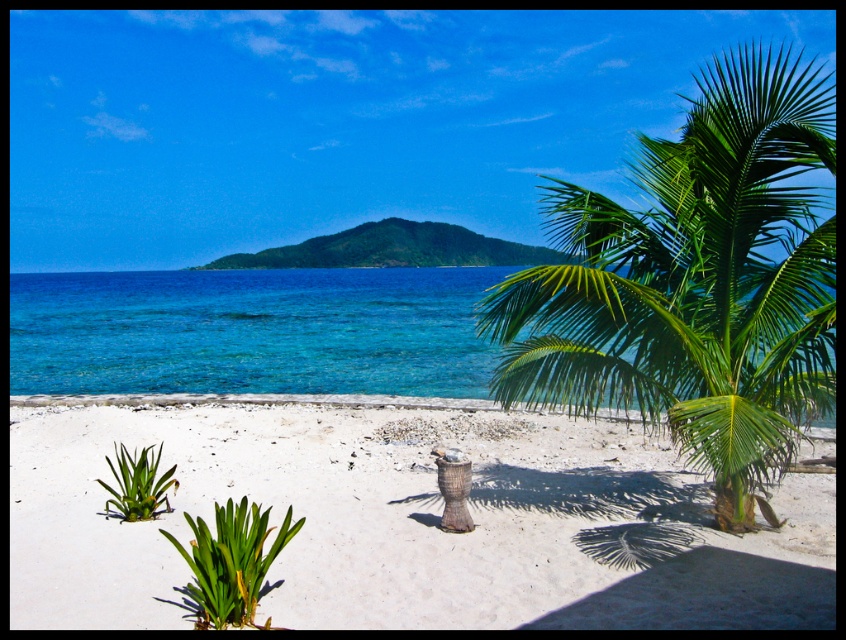
Question: Which object is positioned closest to the clear blue water at center?

Choices:
 (A) green leafy palm at center
 (B) white sandy beach at center

Answer: (A)

Question: Can you confirm if white sandy beach at center is thinner than clear blue water at center?

Choices:
 (A) yes
 (B) no

Answer: (A)

Question: Which point appears closest to the camera in this image?

Choices:
 (A) (709, 304)
 (B) (778, 547)

Answer: (B)

Question: Is green leafy palm at center bigger than clear blue water at center?

Choices:
 (A) no
 (B) yes

Answer: (B)

Question: Is white sandy beach at center to the right of green leafy palm at center from the viewer's perspective?

Choices:
 (A) no
 (B) yes

Answer: (A)

Question: Which is nearer to the clear blue water at center?

Choices:
 (A) white sandy beach at center
 (B) green leafy palm at center

Answer: (B)